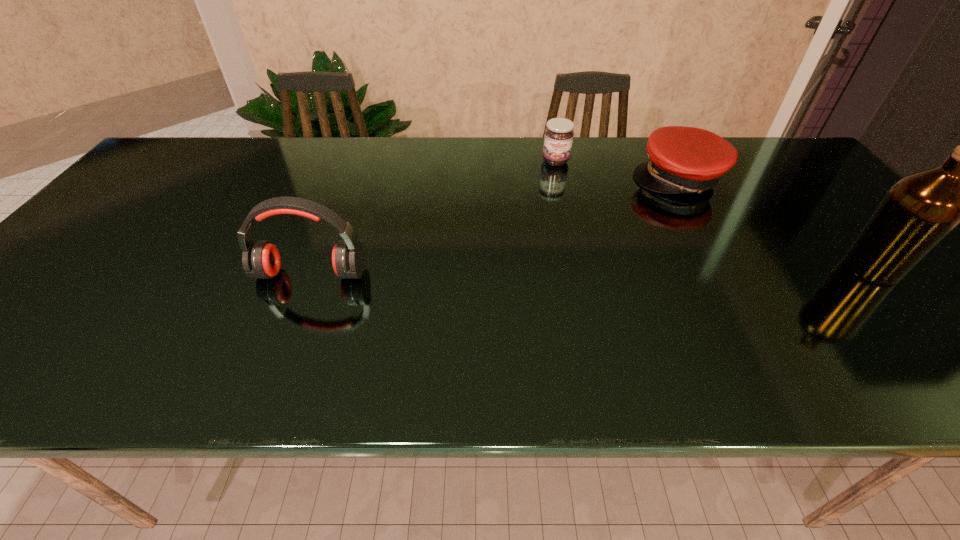
Locate an element on the screen. The height and width of the screenshot is (540, 960). free space between the third shortest object and the tallest object is located at coordinates (591, 271).

The image size is (960, 540). In order to click on unoccupied area between the tallest object and the leftmost object in this screenshot , I will do `click(591, 271)`.

Locate an element on the screen. free spot between the rightmost object and the cap is located at coordinates (775, 224).

The image size is (960, 540). What are the coordinates of `empty space that is in between the cap and the tallest object` in the screenshot? It's located at (775, 224).

Find the location of a particular element. free space between the second tallest object and the jam is located at coordinates (433, 218).

The image size is (960, 540). I want to click on empty space that is in between the rightmost object and the third object from left to right, so click(775, 224).

Locate an element on the screen. This screenshot has height=540, width=960. empty space that is in between the cap and the rightmost object is located at coordinates (775, 224).

This screenshot has width=960, height=540. I want to click on vacant point located between the cap and the earphone, so click(x=494, y=226).

This screenshot has width=960, height=540. Find the location of `vacant area that lies between the second object from left to right and the rightmost object`. vacant area that lies between the second object from left to right and the rightmost object is located at coordinates (713, 214).

Where is `vacant point located between the jam and the cap`? This screenshot has height=540, width=960. vacant point located between the jam and the cap is located at coordinates (616, 170).